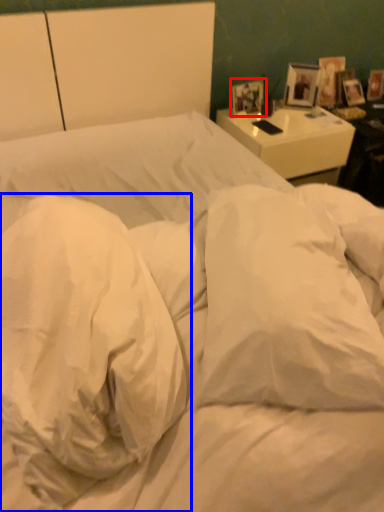
Question: Among these objects, which one is nearest to the camera, picture frame (highlighted by a red box) or pillow (highlighted by a blue box)?

Choices:
 (A) picture frame
 (B) pillow

Answer: (B)